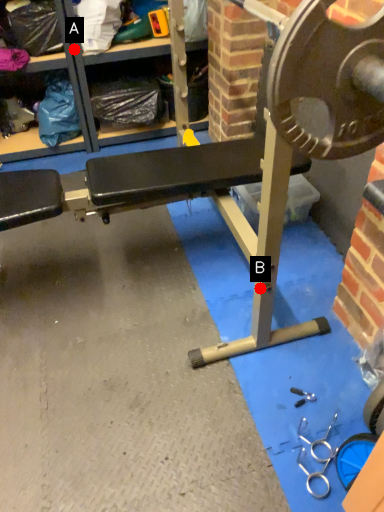
Question: Two points are circled on the image, labeled by A and B beside each circle. Which point is closer to the camera?

Choices:
 (A) A is closer
 (B) B is closer

Answer: (B)